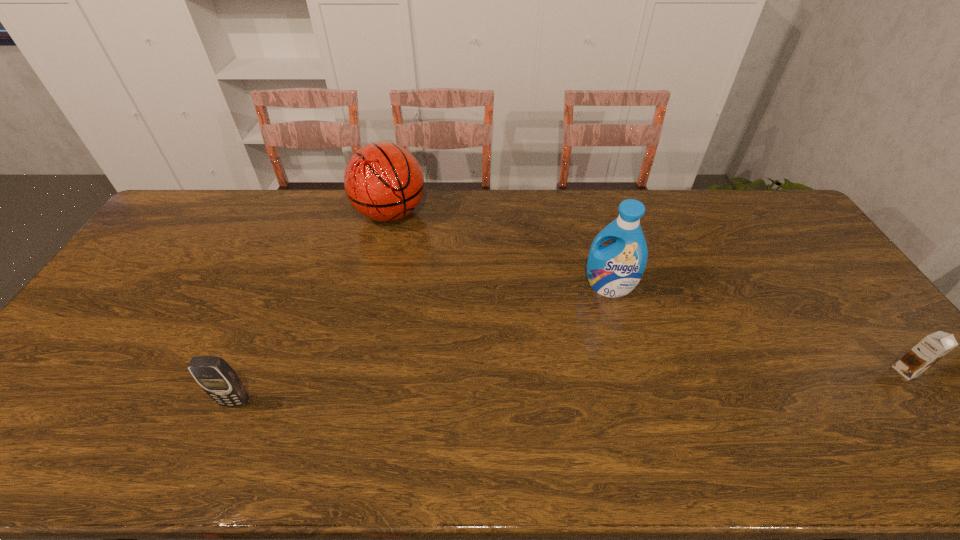
Image resolution: width=960 pixels, height=540 pixels. Identify the location of the second shortest object. (217, 378).

Identify the location of cellular telephone. The width and height of the screenshot is (960, 540). (217, 378).

Find the location of a particular element. This screenshot has width=960, height=540. the second nearest object is located at coordinates (933, 347).

Where is `the rightmost object`? The width and height of the screenshot is (960, 540). the rightmost object is located at coordinates (933, 347).

Identify the location of the second object from left to right. (383, 181).

Where is `basketball`? The image size is (960, 540). basketball is located at coordinates (383, 181).

Locate an element on the screen. The width and height of the screenshot is (960, 540). the second object from right to left is located at coordinates (613, 270).

At what (x,y) coordinates should I click in order to perform the action: click on the third nearest object. Please return your answer as a coordinate pair (x, y). The width and height of the screenshot is (960, 540). Looking at the image, I should click on (613, 270).

Find the location of `vacant space located 0.320m on the back of the rightmost object`. vacant space located 0.320m on the back of the rightmost object is located at coordinates (830, 274).

The height and width of the screenshot is (540, 960). What are the coordinates of `vacant space situated 0.260m on the side with spill of the farthest object` in the screenshot? It's located at point(435,285).